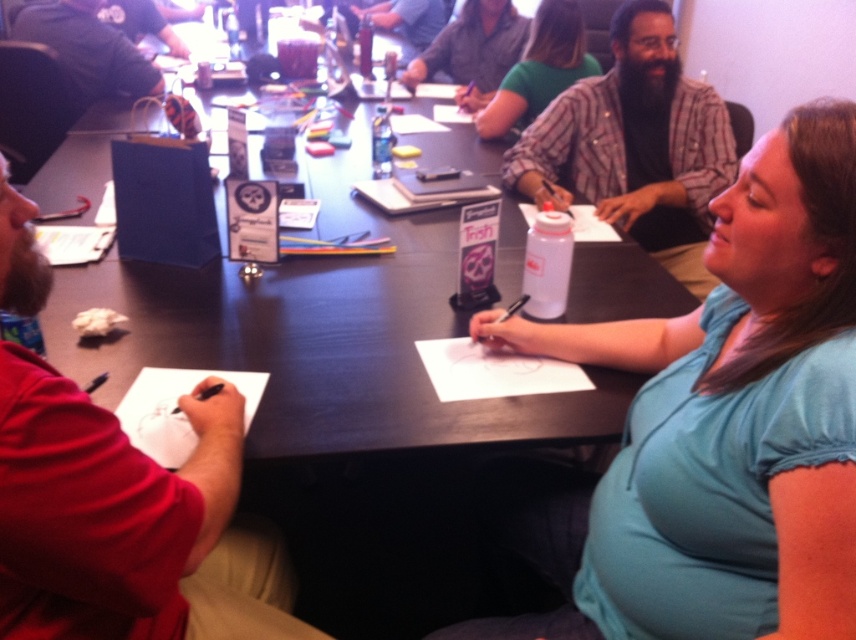
Question: Is blue cotton shirt at center closer to camera compared to black glossy table at center?

Choices:
 (A) yes
 (B) no

Answer: (A)

Question: Which of these objects is positioned closest to the blue cotton shirt at center?

Choices:
 (A) black glossy table at center
 (B) green matte shirt at center

Answer: (A)

Question: Does red shirt at left appear on the right side of striped shirt at center?

Choices:
 (A) no
 (B) yes

Answer: (A)

Question: Considering the real-world distances, which object is farthest from the green shirt at upper center?

Choices:
 (A) green matte shirt at center
 (B) red shirt at left
 (C) striped shirt at center
 (D) blue cotton shirt at center

Answer: (B)

Question: Which is farther from the black glossy table at center?

Choices:
 (A) green matte shirt at center
 (B) blue cotton shirt at center
 (C) green shirt at upper center

Answer: (C)

Question: From the image, what is the correct spatial relationship of green matte shirt at center in relation to green shirt at upper center?

Choices:
 (A) left
 (B) right

Answer: (B)